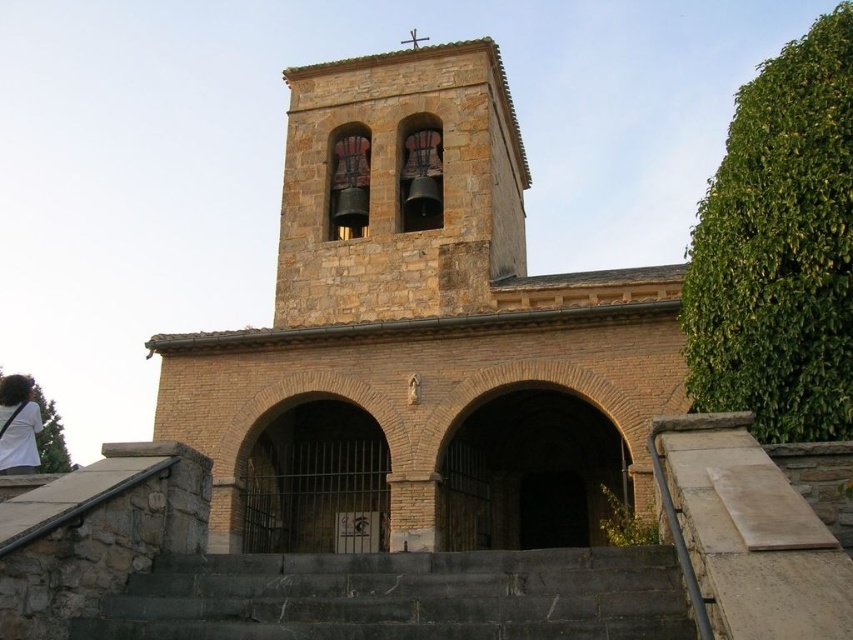
You are standing outside the brown stone chapel at center and want to take a photo. If your camera has a maximum focus range of 30 meters, will it be able to focus on the chapel?

The brown stone chapel at center is 32.22 meters away from the viewer. Since the camera can only focus up to 30 meters, it will not be able to focus on the chapel.

You are standing in front of the traditional stone church with a bell tower. You need to reach the entrance located at the center. Are the dark gray stone stairs at center directly in front of you?

The dark gray stone stairs at center are located at point (401,596), which would place them directly in front of you if you are facing the church entrance at the center. Therefore, yes, the stairs are directly in front of you.